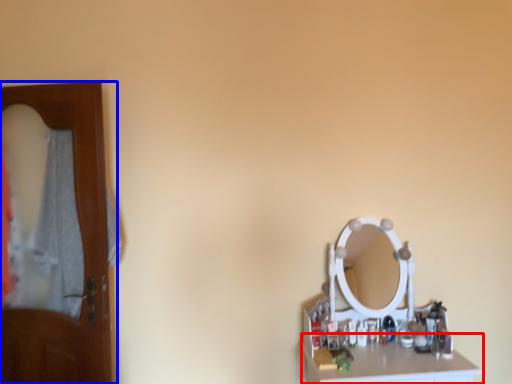
Question: Among these objects, which one is nearest to the camera, counter top (highlighted by a red box) or door (highlighted by a blue box)?

Choices:
 (A) counter top
 (B) door

Answer: (A)